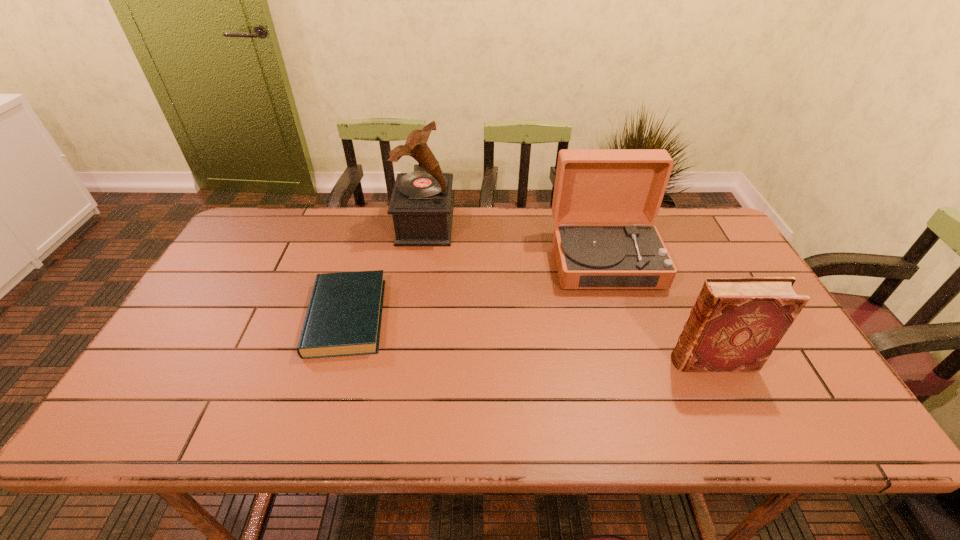
Identify the location of object that stands as the third closest to the right book. The width and height of the screenshot is (960, 540). (344, 314).